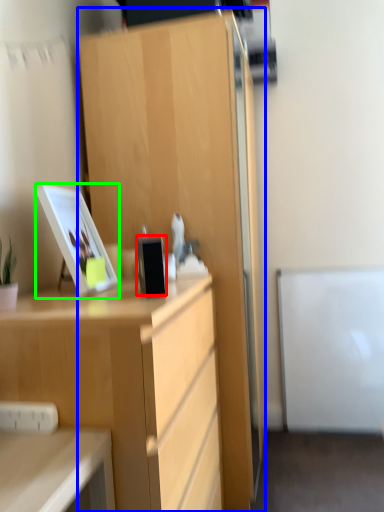
Question: Considering the real-world distances, which object is farthest from appliance (highlighted by a red box)? cabinetry (highlighted by a blue box) or picture frame (highlighted by a green box)?

Choices:
 (A) cabinetry
 (B) picture frame

Answer: (A)